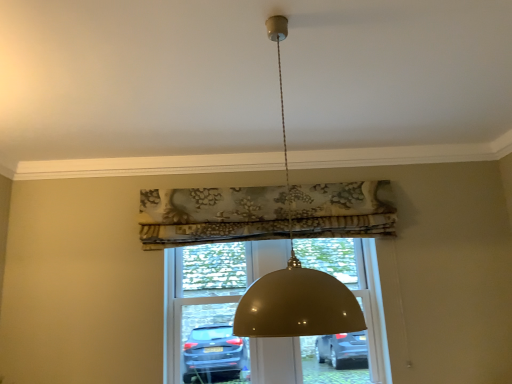
Identify the location of matte gold dome at center. The height and width of the screenshot is (384, 512). (295, 276).

What do you see at coordinates (295, 276) in the screenshot? The width and height of the screenshot is (512, 384). I see `matte gold dome at center` at bounding box center [295, 276].

You are a GUI agent. You are given a task and a screenshot of the screen. Output one action in this format:
    pyautogui.click(x=<x>, y=<y>)
    Task: Click on the matte gold dome at center
    The image size is (512, 384).
    Given the screenshot: What is the action you would take?
    pyautogui.click(x=295, y=276)